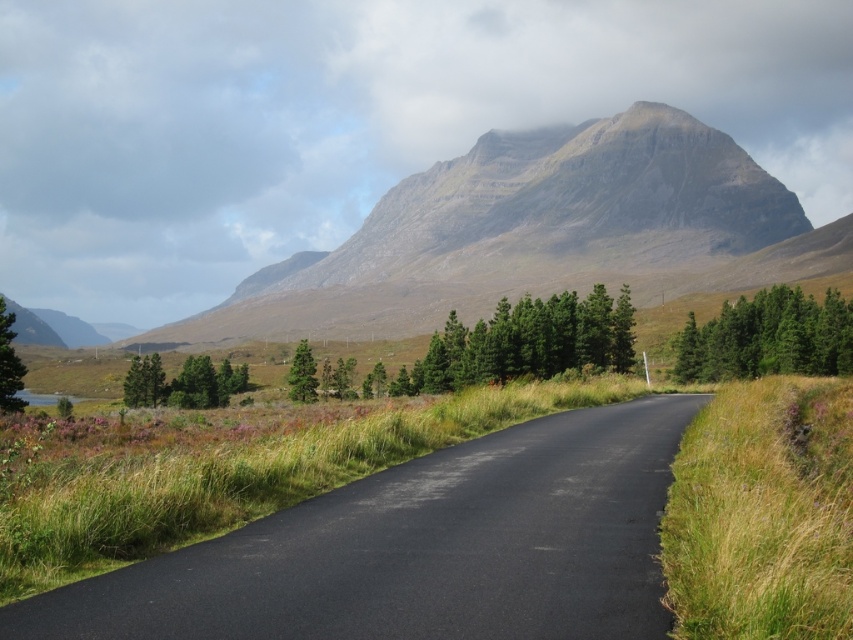
Based on the photo, between green matte tree at left and green matte tree at center, which one has less height?

green matte tree at center

Locate an element on the screen. The image size is (853, 640). green matte tree at left is located at coordinates (9, 364).

Identify the location of green matte tree at left. (9, 364).

Which is behind, point (450, 336) or point (299, 381)?

Point (450, 336)

Is green matte trees at center further to camera compared to green matte tree at center?

No, it is not.

Does point (454, 340) lie in front of point (297, 380)?

That is False.

The height and width of the screenshot is (640, 853). Find the location of `green matte trees at center`. green matte trees at center is located at coordinates (529, 340).

Who is positioned more to the left, green textured trees at left or green matte tree at left?

green textured trees at left is more to the left.

Is the position of green textured trees at left more distant than that of green matte tree at left?

Yes, it is behind green matte tree at left.

What do you see at coordinates (183, 381) in the screenshot?
I see `green textured trees at left` at bounding box center [183, 381].

Image resolution: width=853 pixels, height=640 pixels. Identify the location of green textured trees at left. (183, 381).